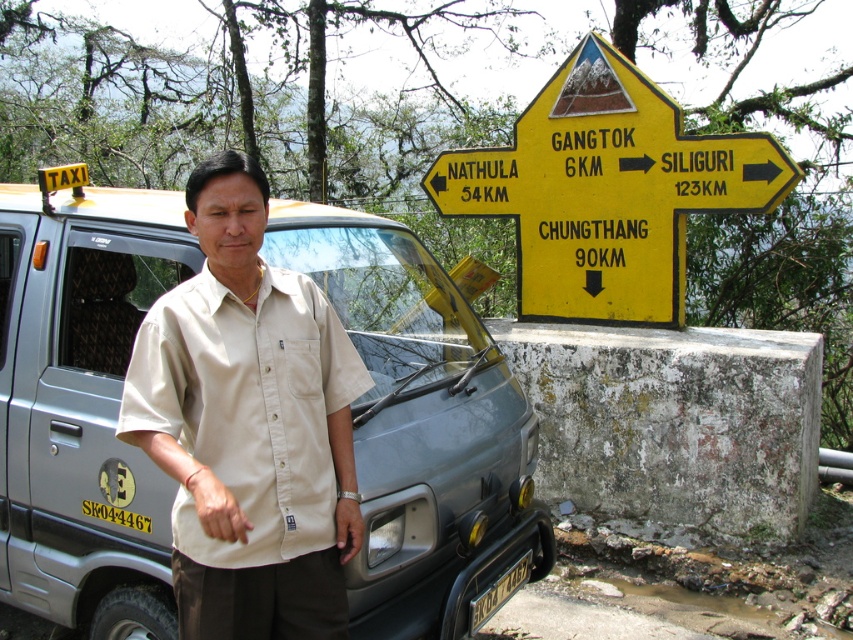
You are standing at the point marked as point (669, 131) in the image. A taxi van is parked nearby. If you want to walk straight towards the taxi van, will you be able to reach it without obstacles?

The distance of point (669, 131) from viewer is 5.54 meters, so you can walk straight towards the taxi van and reach it without obstacles.

From the picture: You are a photographer trying to capture the taxi van and the man in a photo. You notice the beige cotton shirt at center and the yellow plastic license plate at lower center. Which object should you focus on first if you want to ensure both are in the frame?

The beige cotton shirt at center is positioned on the left side of yellow plastic license plate at lower center, so focusing on the beige cotton shirt at center first will help ensure both objects are included in the frame.

You are standing next to the silver metallic taxi at left and want to take a photo of it with your camera. The camera is 8.87 feet away from the taxi. Is the distance sufficient to capture the entire taxi in one shot?

The silver metallic taxi at left and camera are 8.87 feet apart from each other. This distance should be sufficient to capture the entire taxi in one shot, assuming a standard camera lens is used.